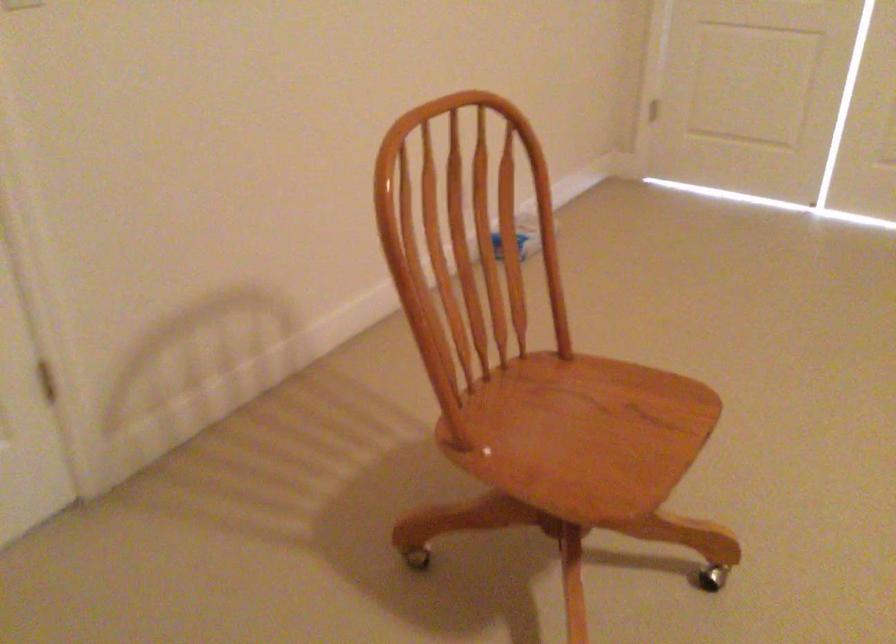
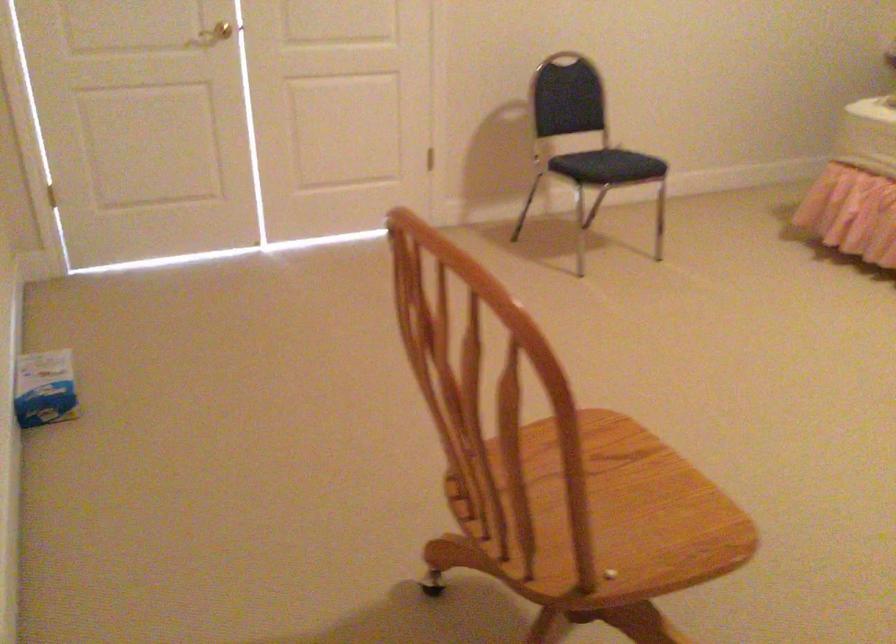
Question: I am providing you with two images of the same scene from different viewpoints. Which of the following objects are not visible in image2?

Choices:
 (A) chair sitting surface
 (B) red plastic colander
 (C) black chair sitting surface
 (D) brass door handle

Answer: (A)